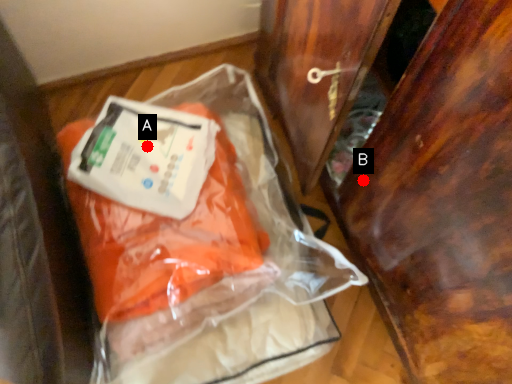
Question: Two points are circled on the image, labeled by A and B beside each circle. Which point is closer to the camera?

Choices:
 (A) A is closer
 (B) B is closer

Answer: (B)